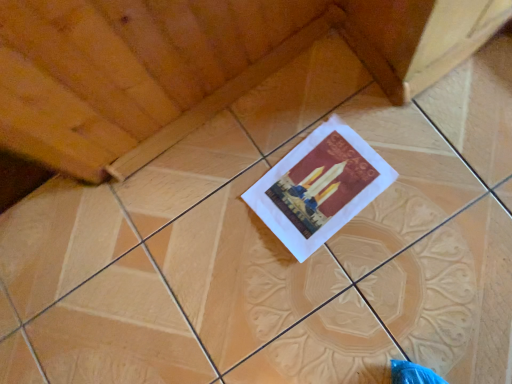
Image resolution: width=512 pixels, height=384 pixels. Find the location of `vacant space in matte paper postcard at center (from a real-world perspective)`. vacant space in matte paper postcard at center (from a real-world perspective) is located at coordinates (321, 188).